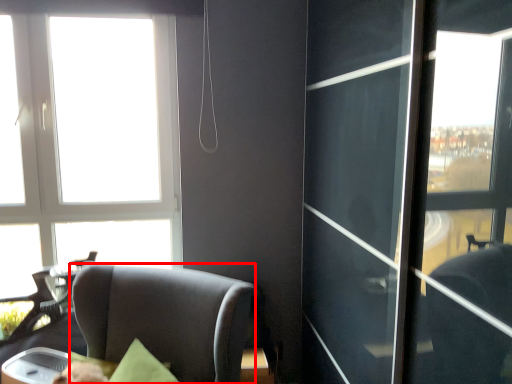
Question: From the image's perspective, what is the correct spatial positioning of chair (annotated by the red box) in reference to window?

Choices:
 (A) above
 (B) below

Answer: (B)